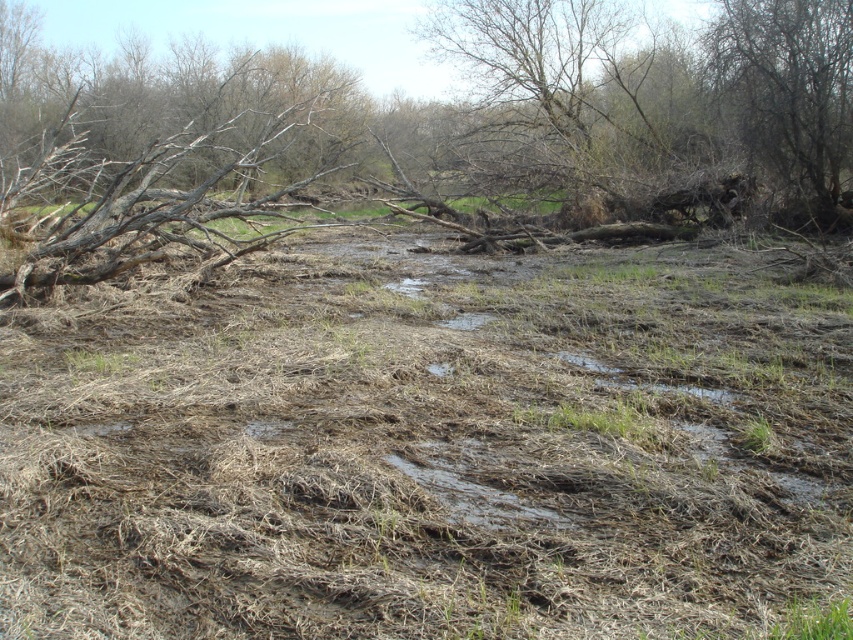
Question: Which object is farther from the camera taking this photo?

Choices:
 (A) bare branches at upper right
 (B) brown dry grass at center

Answer: (A)

Question: Does brown dry grass at center appear on the right side of bare branches at upper right?

Choices:
 (A) no
 (B) yes

Answer: (A)

Question: Is brown dry grass at center above bare branches at upper right?

Choices:
 (A) no
 (B) yes

Answer: (A)

Question: Which of the following is the closest to the observer?

Choices:
 (A) bare branches at upper right
 (B) brown dry grass at center

Answer: (B)

Question: Considering the relative positions of brown dry grass at center and bare branches at upper right in the image provided, where is brown dry grass at center located with respect to bare branches at upper right?

Choices:
 (A) above
 (B) below

Answer: (B)